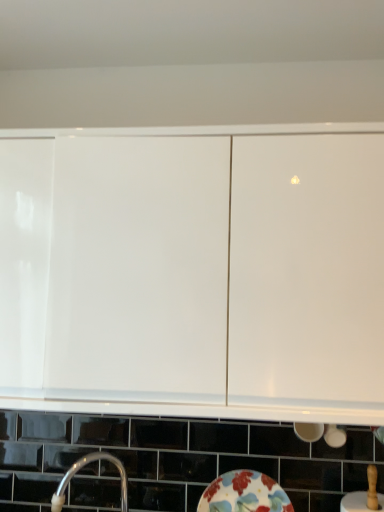
Question: Is silver metallic tap at lower left in front of or behind floral ceramic plate at lower center in the image?

Choices:
 (A) front
 (B) behind

Answer: (A)

Question: Is silver metallic tap at lower left bigger or smaller than floral ceramic plate at lower center?

Choices:
 (A) big
 (B) small

Answer: (A)

Question: Which object is positioned farthest from the silver metallic tap at lower left?

Choices:
 (A) white glossy cabinet at upper center
 (B) floral ceramic plate at lower center

Answer: (A)

Question: Which object is positioned farthest from the silver metallic tap at lower left?

Choices:
 (A) white glossy cabinet at upper center
 (B) floral ceramic plate at lower center

Answer: (A)